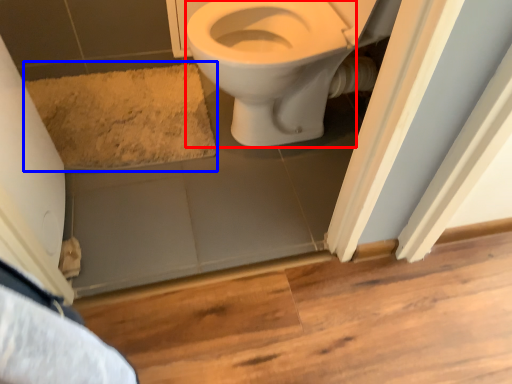
Question: Which of the following is the farthest to the observer, bidet (highlighted by a red box) or bath mat (highlighted by a blue box)?

Choices:
 (A) bidet
 (B) bath mat

Answer: (B)